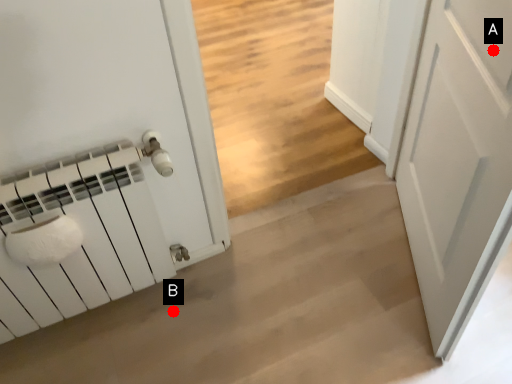
Question: Two points are circled on the image, labeled by A and B beside each circle. Which point is further to the camera?

Choices:
 (A) A is further
 (B) B is further

Answer: (B)